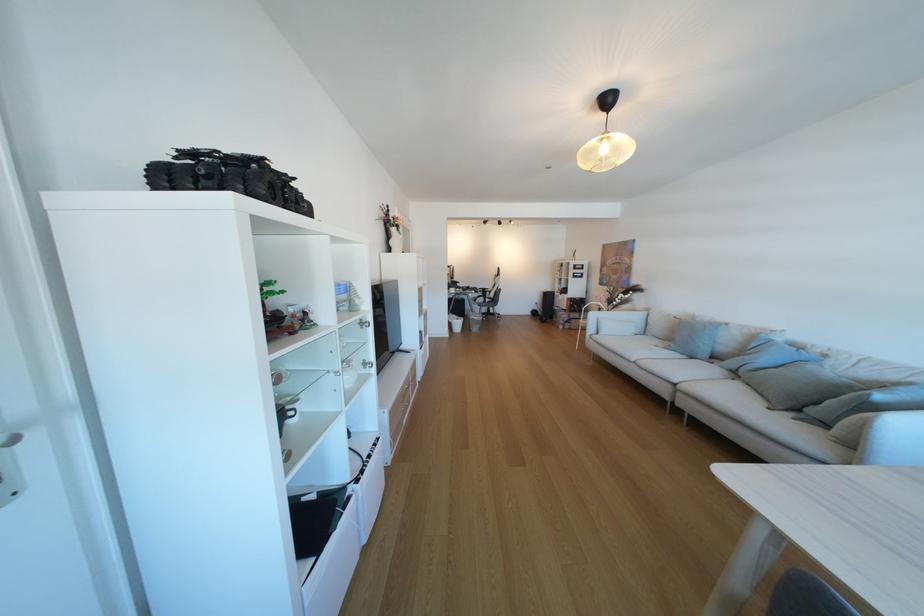
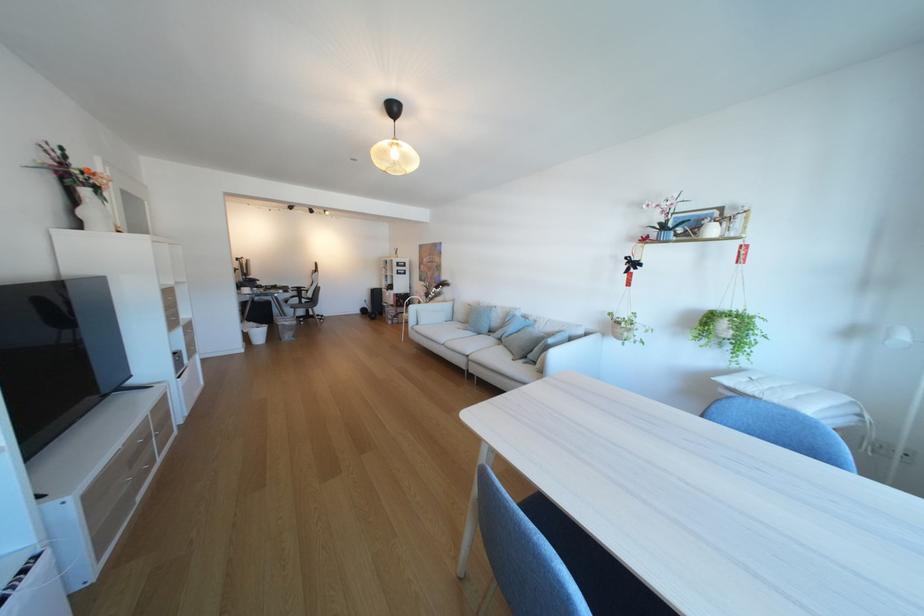
Question: The camera is either moving clockwise (left) or counter-clockwise (right) around the object. The first image is from the beginning of the video and the second image is from the end. Is the camera moving left or right when shooting the video?

Choices:
 (A) Left
 (B) Right

Answer: (A)